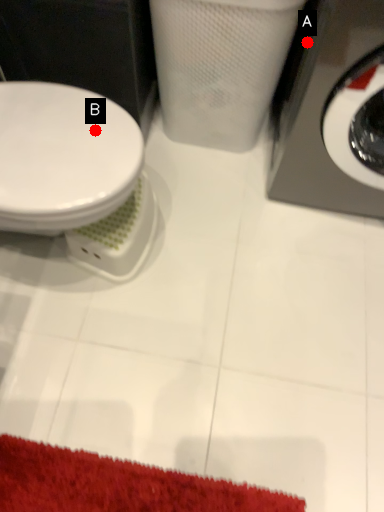
Question: Two points are circled on the image, labeled by A and B beside each circle. Which point is closer to the camera taking this photo?

Choices:
 (A) A is closer
 (B) B is closer

Answer: (B)